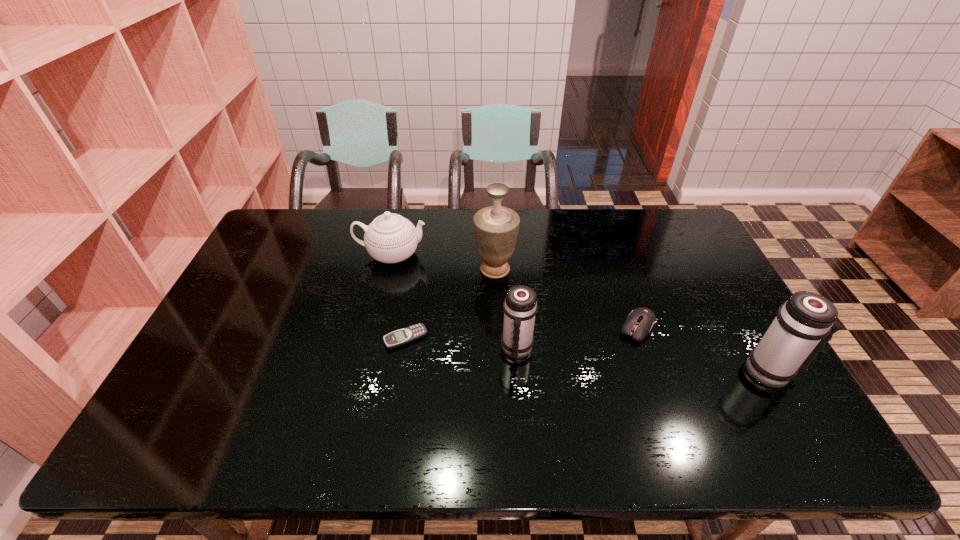
What are the coordinates of `vacant position located on the spout of the chinaware` in the screenshot? It's located at coord(443,255).

Image resolution: width=960 pixels, height=540 pixels. I want to click on vacant space located 0.180m on the front of the computer mouse, so click(x=663, y=403).

Identify the location of vacant space located 0.360m on the left of the beeper. The image size is (960, 540). (252, 338).

Locate an element on the screen. The image size is (960, 540). vacant space situated on the left of the tallest object is located at coordinates (396, 269).

You are a GUI agent. You are given a task and a screenshot of the screen. Output one action in this format:
    pyautogui.click(x=<x>, y=<y>)
    Task: Click on the object that is at the far edge
    
    Given the screenshot: What is the action you would take?
    pyautogui.click(x=390, y=238)

Locate an element on the screen. object present at the near edge is located at coordinates (803, 325).

You are a GUI agent. You are given a task and a screenshot of the screen. Output one action in this format:
    pyautogui.click(x=<x>, y=<y>)
    Task: Click on the object at the right edge
    The width and height of the screenshot is (960, 540).
    Given the screenshot: What is the action you would take?
    pyautogui.click(x=803, y=325)

In order to click on object that is positioned at the near right corner in this screenshot , I will do `click(803, 325)`.

The image size is (960, 540). In the image, there is a desktop. Find the location of `free region at the far edge`. free region at the far edge is located at coordinates (526, 238).

Locate an element on the screen. This screenshot has width=960, height=540. vacant space at the near edge is located at coordinates (536, 406).